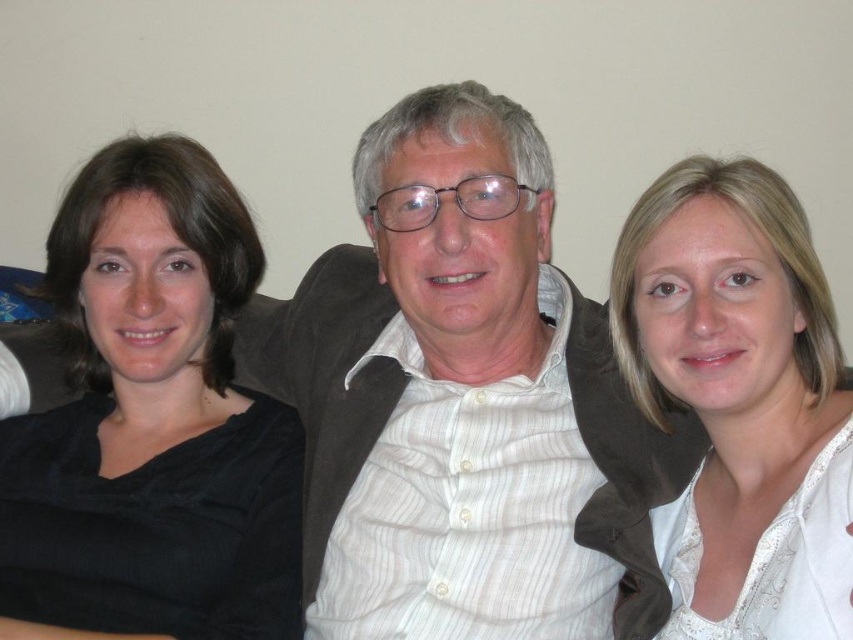
You are standing in front of a group photo of three people sitting on a couch. You notice a point marked at coordinates (152, 420). Which object from the scene corresponds to this point?

The point at coordinates (152, 420) corresponds to the black matte shirt at left.

You are a photographer trying to adjust the lighting for a group photo. You notice the black matte shirt at left and the white lace blouse at right. Which clothing item is positioned lower in the frame?

The black matte shirt at left is located below the white lace blouse at right, so it is positioned lower in the frame.